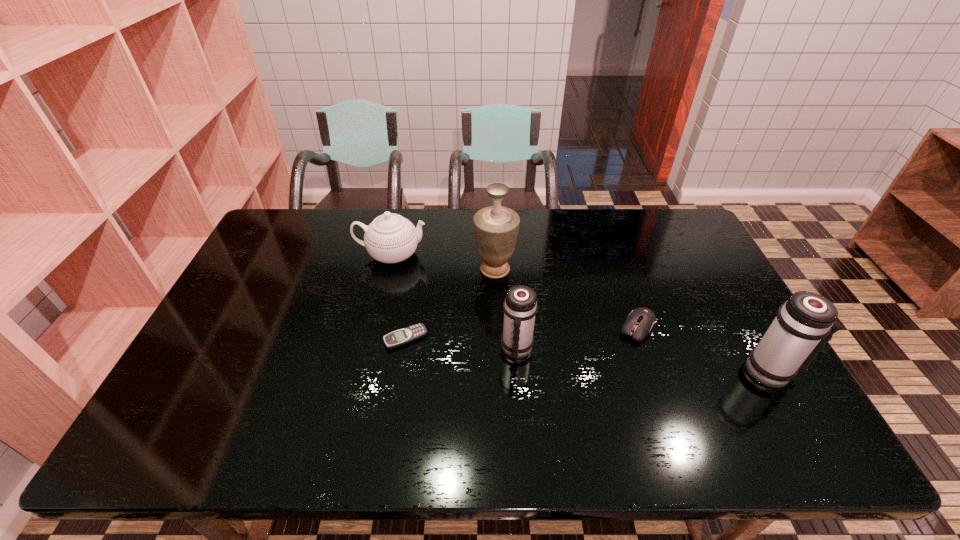
The height and width of the screenshot is (540, 960). In the image, there is a desktop. What are the coordinates of `free space at the left edge` in the screenshot? It's located at (261, 271).

This screenshot has height=540, width=960. I want to click on free space at the right edge of the desktop, so click(708, 295).

You are a GUI agent. You are given a task and a screenshot of the screen. Output one action in this format:
    pyautogui.click(x=<x>, y=<y>)
    Task: Click on the free spot at the far right corner of the desktop
    The width and height of the screenshot is (960, 540).
    Given the screenshot: What is the action you would take?
    pyautogui.click(x=676, y=225)

I want to click on free space between the shortest object and the shorter thermos bottle, so click(461, 343).

I want to click on vacant area between the third tallest object and the chinaware, so click(x=454, y=302).

The image size is (960, 540). In order to click on free spot between the rightmost object and the computer mouse in this screenshot , I will do `click(705, 349)`.

This screenshot has height=540, width=960. Identify the location of vacant area between the right thermos bottle and the beeper. (588, 354).

Locate an element on the screen. The height and width of the screenshot is (540, 960). vacant area that lies between the left thermos bottle and the shortest object is located at coordinates (461, 343).

This screenshot has height=540, width=960. I want to click on empty location between the urn and the chinaware, so click(x=444, y=262).

Identify which object is located as the fifth nearest to the fifth object from left to right. Please provide its 2D coordinates. Your answer should be formatted as a tuple, i.e. [(x, y)], where the tuple contains the x and y coordinates of a point satisfying the conditions above.

[(390, 238)]